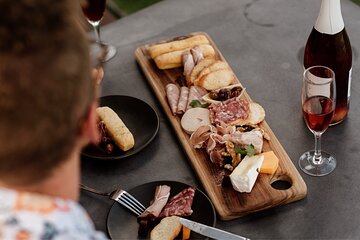
This screenshot has height=240, width=360. What are the coordinates of `wine bottle` in the screenshot? It's located at (324, 53).